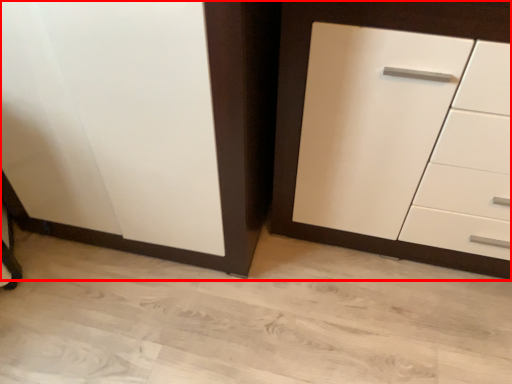
Question: From the image, what is the correct spatial relationship of cupboard (annotated by the red box) in relation to chest of drawers?

Choices:
 (A) left
 (B) right

Answer: (A)